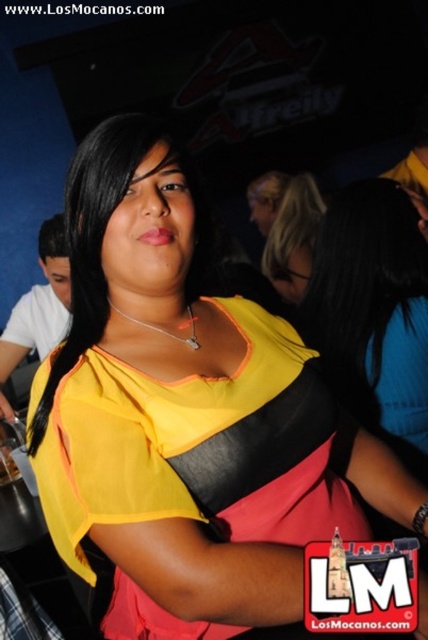
You are at a party and want to take a photo of the yellow matte shirt at center and the translucent glass beverage at center. Which object will appear larger in your photo?

The yellow matte shirt at center will appear larger in the photo because it is bigger than the translucent glass beverage at center.

You are a photographer at the event and want to ensure both the yellow matte shirt at center and the matte black hair at upper center are clearly visible in your photo. Given their sizes, which object should you focus on first to ensure proper focus?

The yellow matte shirt at center is smaller than the matte black hair at upper center, so you should focus on the yellow matte shirt at center first since smaller objects may require closer attention to maintain sharpness in the photo.

You are standing in the same room as the woman wearing the yellow matte shirt at center. If you want to whisper something to her without being overheard, should you move closer or stay where you are?

You should move closer to the yellow matte shirt at center. Since you are currently 1.22 meters apart, moving closer would make it easier to whisper without being overheard.